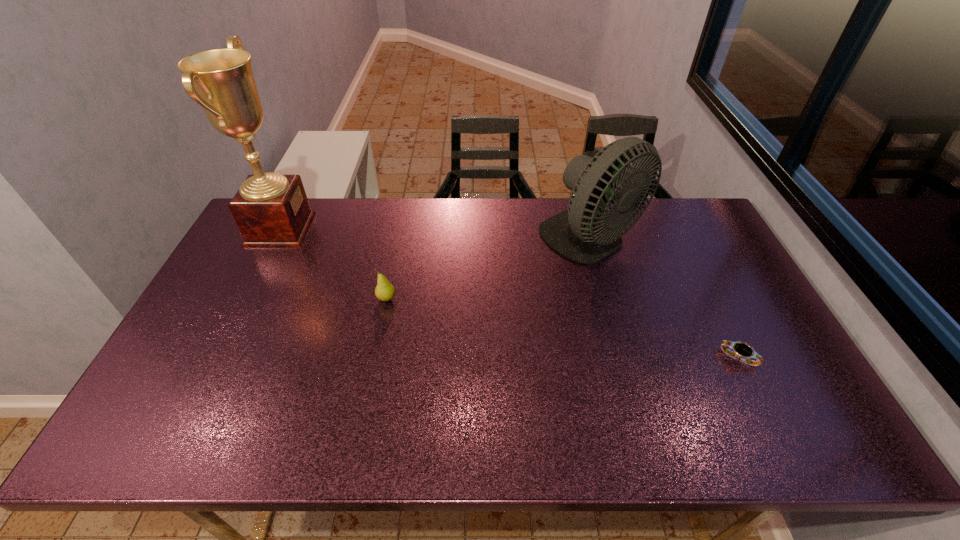
I want to click on trophy cup, so click(x=271, y=210).

Identify the location of the tallest object. (271, 210).

I want to click on the third shortest object, so click(x=577, y=233).

Locate an element on the screen. This screenshot has width=960, height=540. the second object from right to left is located at coordinates (577, 233).

The height and width of the screenshot is (540, 960). Identify the location of pear. (384, 291).

This screenshot has height=540, width=960. I want to click on the third farthest object, so click(384, 291).

The height and width of the screenshot is (540, 960). What are the coordinates of `watch` in the screenshot? It's located at (742, 351).

Where is `the nearest object`? the nearest object is located at coordinates (742, 351).

Identify the location of vacant space situated 0.300m on the plaque of the trophy cup. This screenshot has width=960, height=540. (396, 229).

Locate an element on the screen. Image resolution: width=960 pixels, height=540 pixels. free space located in front of the third shortest object to direct airflow is located at coordinates (604, 289).